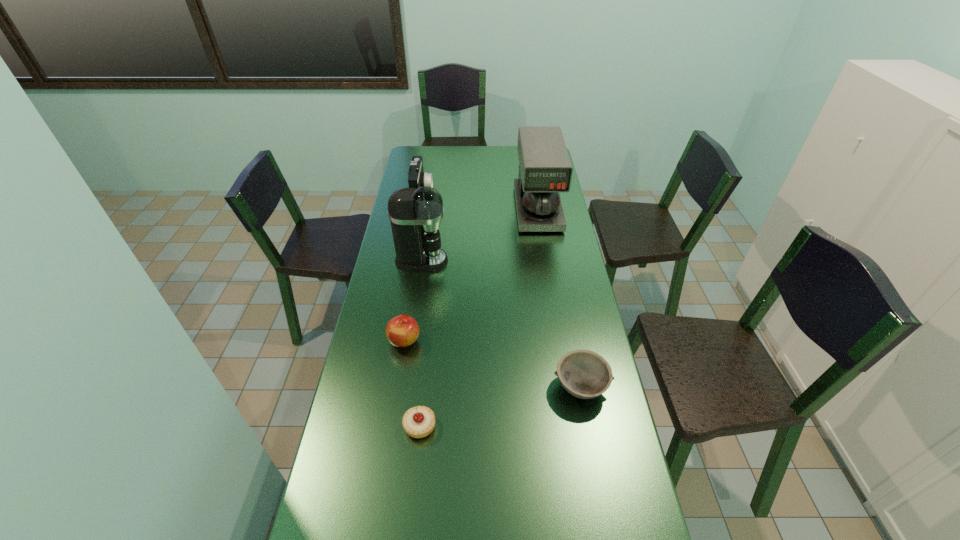
At what (x,y) coordinates should I click in order to perform the action: click on vacant area that lies between the camcorder and the shortest object. Please return your answer as a coordinate pair (x, y). The width and height of the screenshot is (960, 540). Looking at the image, I should click on (420, 309).

Find the location of a particular element. This screenshot has width=960, height=540. free space between the camcorder and the farther coffee maker is located at coordinates (480, 200).

Identify which object is the fourth closest to the left coffee maker. Please provide its 2D coordinates. Your answer should be formatted as a tuple, i.e. [(x, y)], where the tuple contains the x and y coordinates of a point satisfying the conditions above.

[(583, 373)]

Point out which object is positioned as the fourth nearest to the camcorder. Please provide its 2D coordinates. Your answer should be formatted as a tuple, i.e. [(x, y)], where the tuple contains the x and y coordinates of a point satisfying the conditions above.

[(583, 373)]

The width and height of the screenshot is (960, 540). In order to click on vacant point that satisfies the following two spatial constraints: 1. on the back side of the pastry; 2. on the lens of the fourth shortest object in this screenshot , I will do tap(444, 192).

You are a GUI agent. You are given a task and a screenshot of the screen. Output one action in this format:
    pyautogui.click(x=<x>, y=<y>)
    Task: Click on the blank space that satisfies the following two spatial constraints: 1. on the carafe side of the farther coffee maker; 2. place cup under the spout of the fourth nearest object
    This screenshot has height=540, width=960.
    Given the screenshot: What is the action you would take?
    pyautogui.click(x=546, y=261)

Find the location of a particular element. The height and width of the screenshot is (540, 960). vacant position in the image that satisfies the following two spatial constraints: 1. on the back side of the pastry; 2. on the left side of the bowl is located at coordinates (424, 387).

Where is `blank area in the image that satisfies the following two spatial constraints: 1. place cup under the spout of the fifth farthest object; 2. on the right side of the fourth nearest object`? The image size is (960, 540). blank area in the image that satisfies the following two spatial constraints: 1. place cup under the spout of the fifth farthest object; 2. on the right side of the fourth nearest object is located at coordinates (403, 387).

Locate an element on the screen. The width and height of the screenshot is (960, 540). free region that satisfies the following two spatial constraints: 1. on the lens of the camcorder; 2. on the left side of the second nearest object is located at coordinates (388, 387).